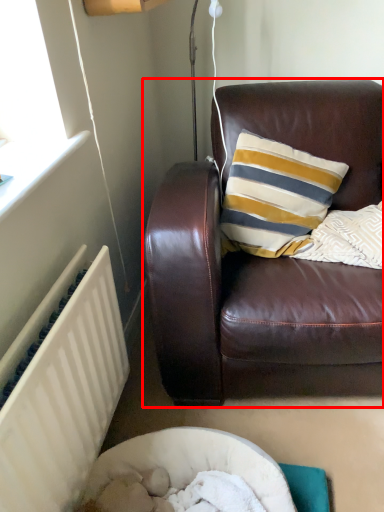
Question: From the image's perspective, what is the correct spatial positioning of studio couch (annotated by the red box) in reference to radiator?

Choices:
 (A) above
 (B) below

Answer: (A)